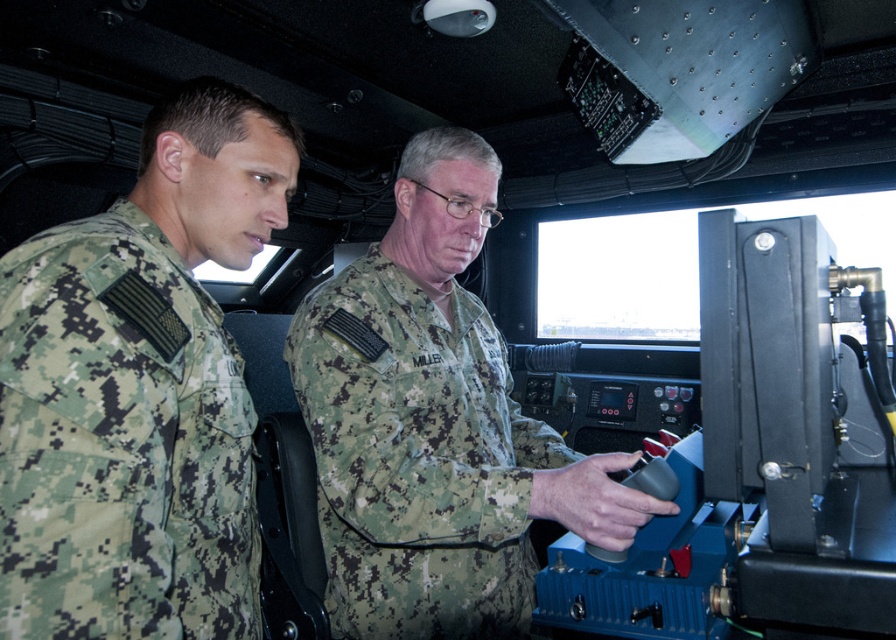
Question: Which point is farther to the camera?

Choices:
 (A) [x=435, y=417]
 (B) [x=229, y=266]

Answer: (A)

Question: Is camouflage uniform at left to the left of camouflage fabric uniform at center from the viewer's perspective?

Choices:
 (A) no
 (B) yes

Answer: (B)

Question: Which point is closer to the camera taking this photo?

Choices:
 (A) (496, 156)
 (B) (82, 586)

Answer: (B)

Question: Does camouflage uniform at left appear on the right side of camouflage fabric uniform at center?

Choices:
 (A) yes
 (B) no

Answer: (B)

Question: Can you confirm if camouflage uniform at left is smaller than camouflage fabric uniform at center?

Choices:
 (A) no
 (B) yes

Answer: (B)